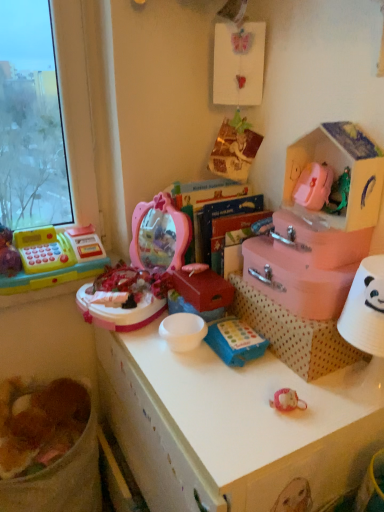
Question: From the image's perspective, is blue fabric toy at center, which ranks as the second toy in top-to-bottom order, under pink cardboard storage box at upper right?

Choices:
 (A) yes
 (B) no

Answer: (A)

Question: Are blue fabric toy at center, the 2th toy when ordered from left to right, and pink cardboard storage box at upper right located far from each other?

Choices:
 (A) no
 (B) yes

Answer: (A)

Question: Could pink cardboard storage box at upper right be considered to be inside blue fabric toy at center, the 2th toy when ordered from left to right?

Choices:
 (A) no
 (B) yes

Answer: (A)

Question: Is blue fabric toy at center, the 2th toy when ordered from left to right, thinner than pink cardboard storage box at upper right?

Choices:
 (A) no
 (B) yes

Answer: (B)

Question: From a real-world perspective, is blue fabric toy at center, the second toy from the back, located higher than pink cardboard storage box at upper right?

Choices:
 (A) yes
 (B) no

Answer: (B)

Question: In terms of size, does matte pink box at center, placed as the third box when sorted from right to left, appear bigger or smaller than brown crumbly food at lower left?

Choices:
 (A) small
 (B) big

Answer: (A)

Question: From a real-world perspective, is matte pink box at center, placed as the third box when sorted from right to left, positioned above or below brown crumbly food at lower left?

Choices:
 (A) above
 (B) below

Answer: (A)

Question: Is point (201, 298) positioned closer to the camera than point (66, 418)?

Choices:
 (A) farther
 (B) closer

Answer: (B)

Question: Considering the positions of matte pink box at center, marked as the 1th box in a left-to-right arrangement, and brown crumbly food at lower left in the image, is matte pink box at center, marked as the 1th box in a left-to-right arrangement, wider or thinner than brown crumbly food at lower left?

Choices:
 (A) wide
 (B) thin

Answer: (B)

Question: Looking at their shapes, would you say pink matte box at center-right, which appears as the second box when viewed from the right, is wider or thinner than white plastic desk at center?

Choices:
 (A) thin
 (B) wide

Answer: (A)

Question: Is pink matte box at center-right, which appears as the second box when viewed from the left, taller or shorter than white plastic desk at center?

Choices:
 (A) short
 (B) tall

Answer: (A)

Question: From a real-world perspective, is pink matte box at center-right, which appears as the second box when viewed from the left, above or below white plastic desk at center?

Choices:
 (A) below
 (B) above

Answer: (B)

Question: Looking at the image, does pink matte box at center-right, which appears as the second box when viewed from the left, seem bigger or smaller compared to white plastic desk at center?

Choices:
 (A) big
 (B) small

Answer: (B)

Question: Based on their sizes in the image, would you say pink cardboard storage box at upper right is bigger or smaller than matte plastic cash register at left, which is the second toy in front-to-back order?

Choices:
 (A) small
 (B) big

Answer: (A)

Question: Is pink cardboard storage box at upper right inside or outside of matte plastic cash register at left, arranged as the 2th toy when viewed from the right?

Choices:
 (A) inside
 (B) outside

Answer: (B)